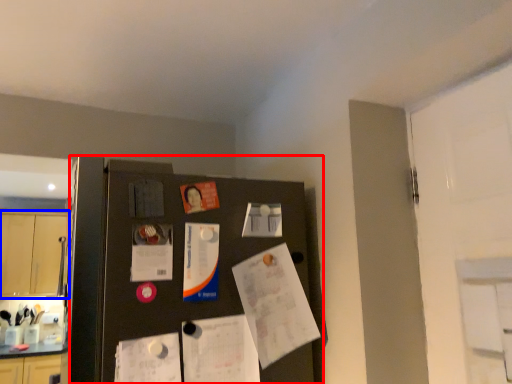
Question: Which object is closer to the camera taking this photo, fridge (highlighted by a red box) or cabinetry (highlighted by a blue box)?

Choices:
 (A) fridge
 (B) cabinetry

Answer: (A)